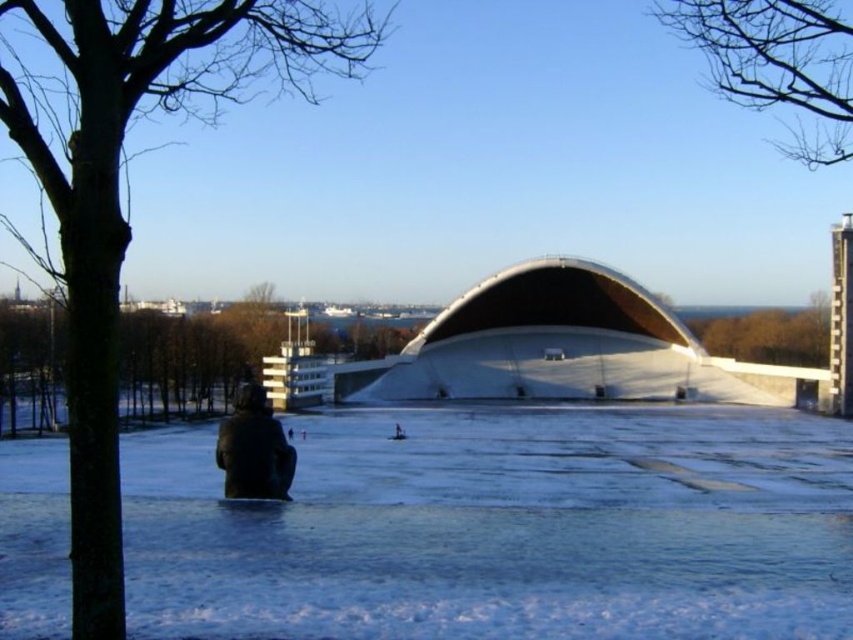
Question: Does bare branches at upper right come behind black matte jacket at lower center?

Choices:
 (A) yes
 (B) no

Answer: (B)

Question: Which of the following is the closest to the observer?

Choices:
 (A) (73, 99)
 (B) (709, 348)
 (C) (235, 445)

Answer: (A)

Question: In this image, where is green leafy tree at left located relative to green leafy tree at upper center?

Choices:
 (A) below
 (B) above

Answer: (A)

Question: Among these points, which one is farthest from the camera?

Choices:
 (A) (836, 618)
 (B) (241, 467)

Answer: (B)

Question: Observing the image, what is the correct spatial positioning of white matte snow at center in reference to brown bark tree at left?

Choices:
 (A) right
 (B) left

Answer: (A)

Question: Which object is the closest to the green leafy tree at upper center?

Choices:
 (A) green leafy tree at left
 (B) white matte snow at center
 (C) bare branches at upper right

Answer: (C)